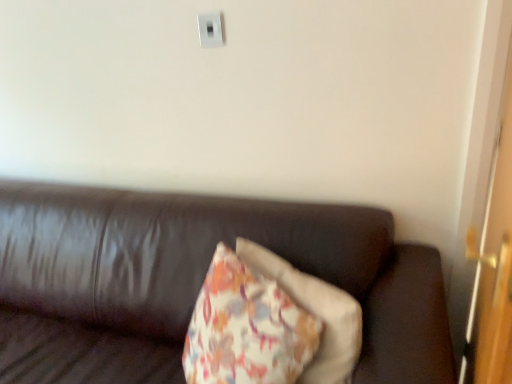
Identify the location of leather couch at center. point(194,281).

Does wooden door at right turn towards white plastic switch at upper center?

No, wooden door at right is not aimed at white plastic switch at upper center.

From the image's perspective, is wooden door at right above or below white plastic switch at upper center?

Based on their image positions, wooden door at right is located beneath white plastic switch at upper center.

Considering the sizes of objects wooden door at right and white plastic switch at upper center in the image provided, who is thinner, wooden door at right or white plastic switch at upper center?

With smaller width is white plastic switch at upper center.

Consider the image. Who is smaller, white plastic switch at upper center or wooden door at right?

Smaller between the two is white plastic switch at upper center.

Does white plastic switch at upper center have a greater height compared to wooden door at right?

In fact, white plastic switch at upper center may be shorter than wooden door at right.

Does white plastic switch at upper center turn towards wooden door at right?

No.

Is white plastic switch at upper center in front of or behind wooden door at right in the image?

Clearly, white plastic switch at upper center is behind wooden door at right.

Between leather couch at center and wooden door at right, which one has smaller width?

wooden door at right is thinner.

From the image's perspective, would you say leather couch at center is positioned over wooden door at right?

Incorrect, from the image's perspective, leather couch at center is lower than wooden door at right.

Locate an element on the screen. The height and width of the screenshot is (384, 512). studio couch behind the wooden door at right is located at coordinates (194, 281).

Is wooden door at right closer to camera compared to leather couch at center?

Yes, wooden door at right is closer to the camera.

From a real-world perspective, is wooden door at right over leather couch at center?

Indeed, from a real-world perspective, wooden door at right stands above leather couch at center.

How many degrees apart are the facing directions of wooden door at right and leather couch at center?

81.2 degrees separate the facing orientations of wooden door at right and leather couch at center.

Visually, is wooden door at right positioned to the left or to the right of leather couch at center?

In the image, wooden door at right appears on the right side of leather couch at center.

What's the angular difference between leather couch at center and white plastic switch at upper center's facing directions?

The angular difference between leather couch at center and white plastic switch at upper center is 0.255 degrees.

Is leather couch at center closer to camera compared to white plastic switch at upper center?

Yes, the depth of leather couch at center is less than that of white plastic switch at upper center.

Is leather couch at center smaller than white plastic switch at upper center?

Incorrect, leather couch at center is not smaller in size than white plastic switch at upper center.

Is leather couch at center situated inside white plastic switch at upper center or outside?

leather couch at center exists outside the volume of white plastic switch at upper center.

You are a GUI agent. You are given a task and a screenshot of the screen. Output one action in this format:
    pyautogui.click(x=<x>, y=<y>)
    Task: Click on the studio couch in front of the white plastic switch at upper center
    
    Given the screenshot: What is the action you would take?
    pyautogui.click(x=194, y=281)

Considering the sizes of objects white plastic switch at upper center and leather couch at center in the image provided, who is taller, white plastic switch at upper center or leather couch at center?

leather couch at center.

Would you say white plastic switch at upper center contains leather couch at center?

No, leather couch at center is not inside white plastic switch at upper center.

The height and width of the screenshot is (384, 512). In order to click on door below the white plastic switch at upper center (from a real-world perspective) in this screenshot , I will do `click(493, 268)`.

The height and width of the screenshot is (384, 512). Identify the location of electric outlet behind the wooden door at right. (210, 30).

Based on their spatial positions, is wooden door at right or white plastic switch at upper center closer to leather couch at center?

wooden door at right lies closer to leather couch at center than the other object.

From the image, which object appears to be farther from white plastic switch at upper center, wooden door at right or leather couch at center?

wooden door at right lies further to white plastic switch at upper center than the other object.

Based on their spatial positions, is leather couch at center or wooden door at right further from white plastic switch at upper center?

wooden door at right is further to white plastic switch at upper center.

Looking at the image, which one is located closer to wooden door at right, white plastic switch at upper center or leather couch at center?

leather couch at center is positioned closer to the anchor wooden door at right.

In the scene shown: Looking at the image, which one is located further to wooden door at right, leather couch at center or white plastic switch at upper center?

white plastic switch at upper center.

Estimate the real-world distances between objects in this image. Which object is closer to leather couch at center, white plastic switch at upper center or wooden door at right?

The object closer to leather couch at center is wooden door at right.

This screenshot has height=384, width=512. Identify the location of electric outlet between leather couch at center and wooden door at right from left to right. (210, 30).